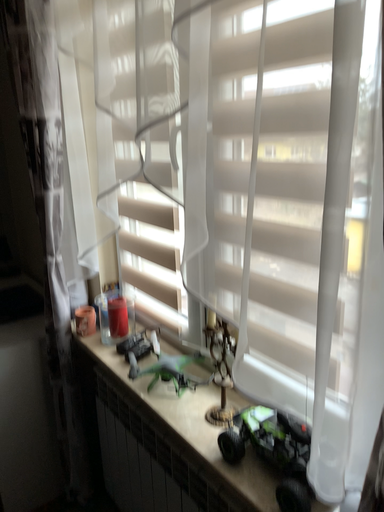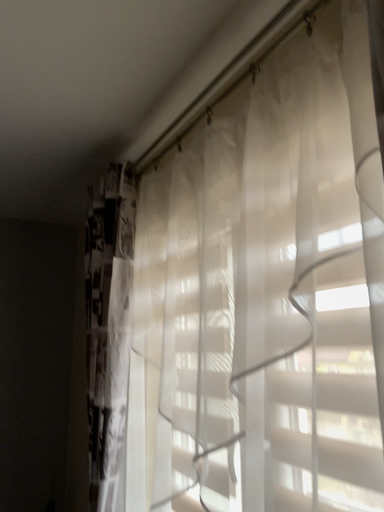
Question: How did the camera likely rotate when shooting the video?

Choices:
 (A) rotated upward
 (B) rotated downward

Answer: (A)